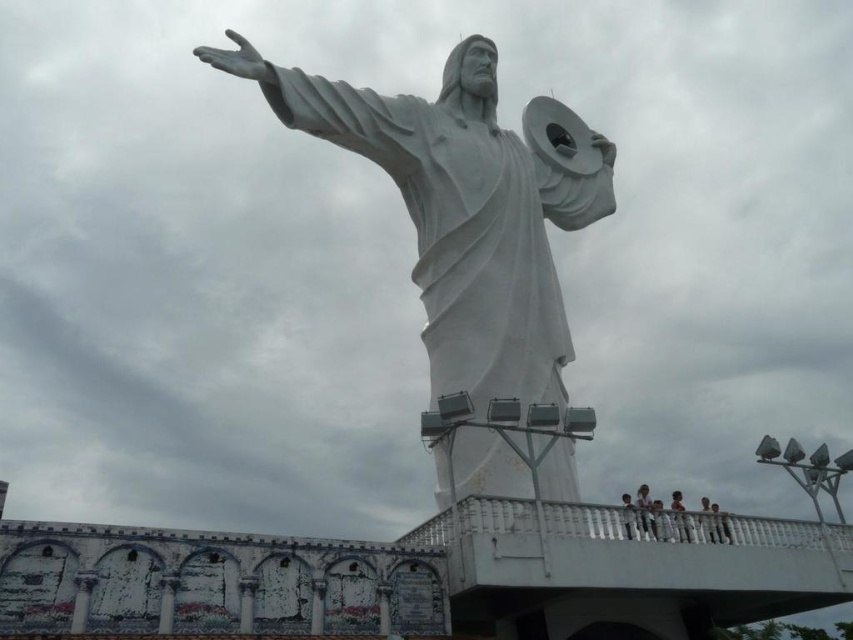
Question: Is white marble person at lower right positioned behind light skin human at center?

Choices:
 (A) yes
 (B) no

Answer: (A)

Question: Which point is farther to the camera?

Choices:
 (A) (415, 186)
 (B) (662, 508)
 (C) (624, 506)

Answer: (B)

Question: Considering the real-world distances, which object is farthest from the white marble statue at center?

Choices:
 (A) white statue at center
 (B) light skin human at center

Answer: (A)

Question: Which point is closer to the camera?

Choices:
 (A) (666, 522)
 (B) (721, 538)

Answer: (A)

Question: Does light brown wooden fence at lower right appear over white matte statue at center?

Choices:
 (A) yes
 (B) no

Answer: (A)

Question: Can you confirm if white painted metal railing at lower center is positioned below light skin human at center?

Choices:
 (A) yes
 (B) no

Answer: (A)